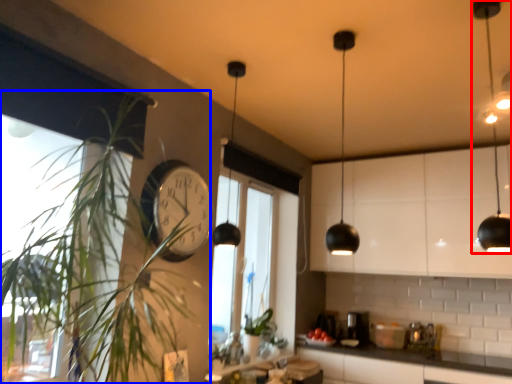
Question: Which of the following is the closest to the observer, light fixture (highlighted by a red box) or houseplant (highlighted by a blue box)?

Choices:
 (A) light fixture
 (B) houseplant

Answer: (B)